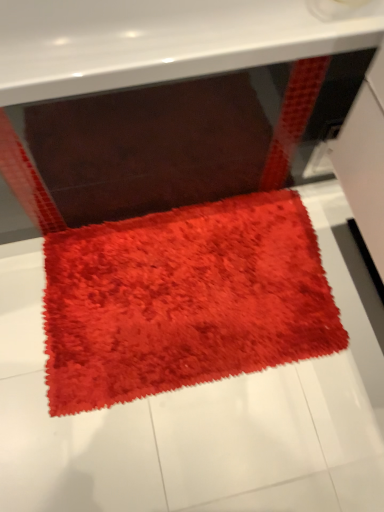
Question: Should I look upward or downward to see shaggy red towel at center?

Choices:
 (A) down
 (B) up

Answer: (A)